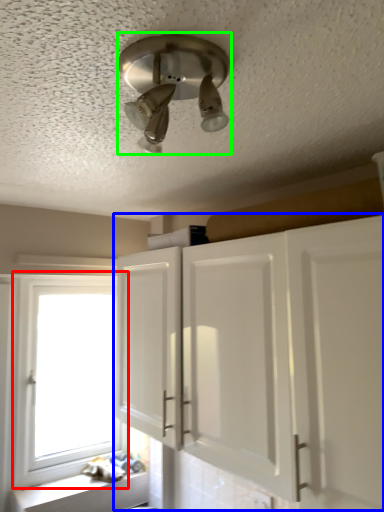
Question: Which object is positioned farthest from window (highlighted by a red box)? Select from cabinetry (highlighted by a blue box) and light fixture (highlighted by a green box).

Choices:
 (A) cabinetry
 (B) light fixture

Answer: (B)